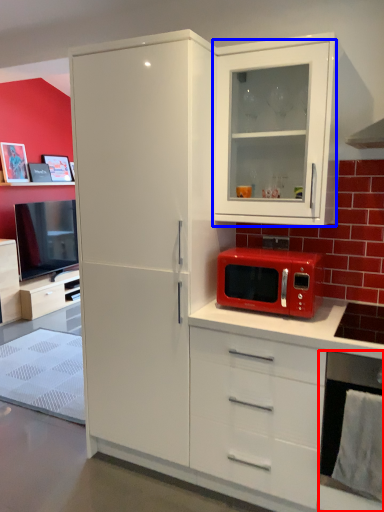
Question: Among these objects, which one is farthest to the camera, appliance (highlighted by a red box) or cabinetry (highlighted by a blue box)?

Choices:
 (A) appliance
 (B) cabinetry

Answer: (B)